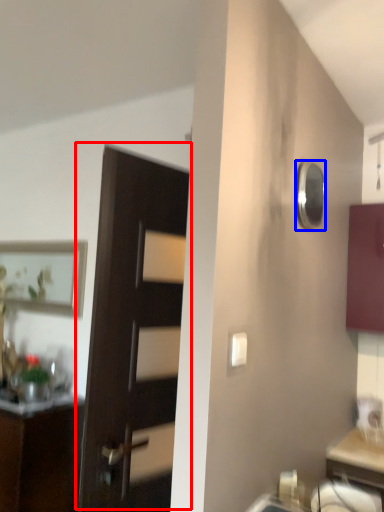
Question: Which object is closer to the camera taking this photo, door (highlighted by a red box) or mirror (highlighted by a blue box)?

Choices:
 (A) door
 (B) mirror

Answer: (A)